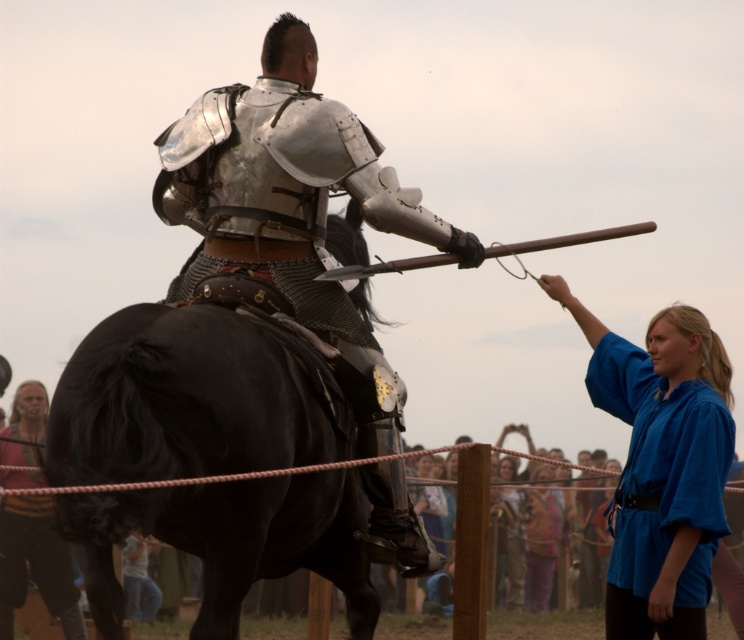
You are a medieval knight preparing for a tournament. You need to place a multicolored fabric at lower center on the ground in front of you. Where should you place it relative to your current position?

The multicolored fabric at lower center should be placed at coordinates point (541, 538) relative to your current position.

You are an archer positioned at the edge of the field, aiming at a target behind the multicolored fabric at lower center and the blue cotton shirt at center. Which object should you avoid hitting to ensure your arrow reaches the target?

You should avoid hitting the multicolored fabric at lower center because it is closer to the viewer and will block the arrow from reaching the target behind the blue cotton shirt at center.

Based on the scene description, where is the shiny metallic armor at center located in the image?

The shiny metallic armor at center is located at the 2D coordinates point (295, 211) in the image.